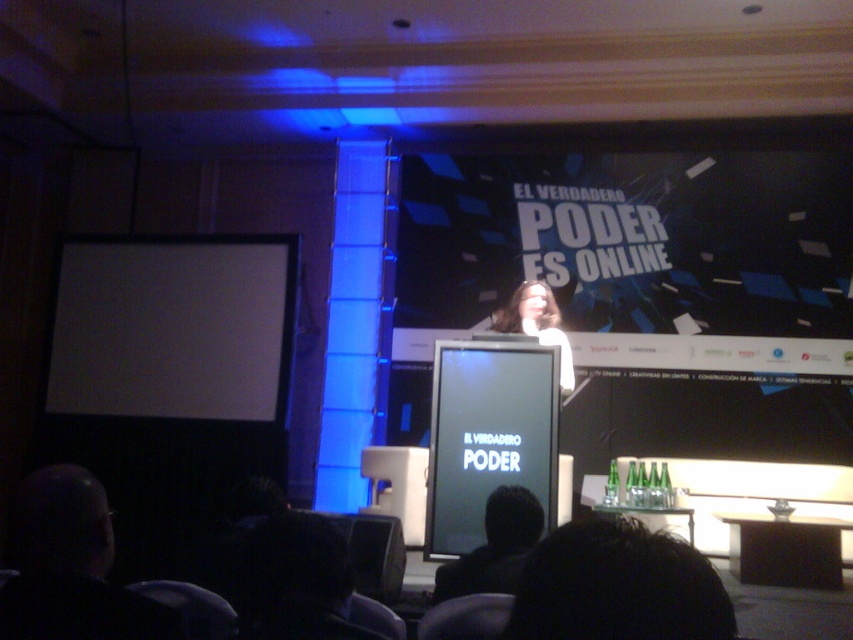
Question: Does black hair at center have a lesser width compared to white matte hair at center?

Choices:
 (A) yes
 (B) no

Answer: (A)

Question: Considering the real-world distances, which object is closest to the black hair at center?

Choices:
 (A) white matte projection screen at left
 (B) black glossy projection screen at center

Answer: (B)

Question: Is black glossy projection screen at center wider than white matte hair at center?

Choices:
 (A) yes
 (B) no

Answer: (A)

Question: Does white matte projection screen at left appear over black hair at center?

Choices:
 (A) yes
 (B) no

Answer: (A)

Question: Considering the real-world distances, which object is closest to the dark hair at lower left?

Choices:
 (A) black hair at center
 (B) white matte projection screen at left
 (C) black glossy projection screen at center
 (D) white matte hair at center

Answer: (A)

Question: Estimate the real-world distances between objects in this image. Which object is closer to the white matte projection screen at left?

Choices:
 (A) dark hair at lower left
 (B) black hair at center
 (C) white matte hair at center

Answer: (C)